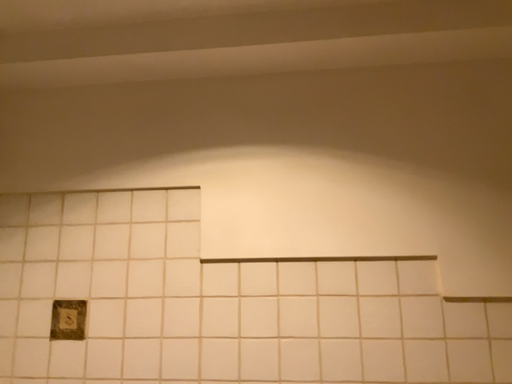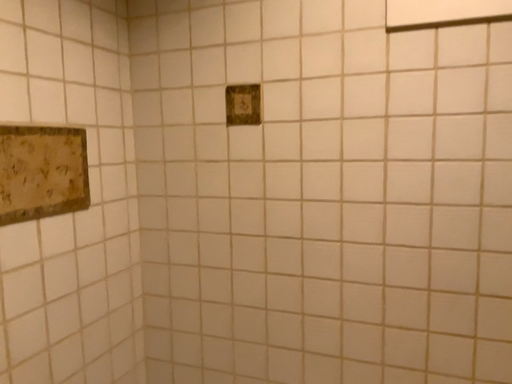
Question: How did the camera likely rotate when shooting the video?

Choices:
 (A) rotated downward
 (B) rotated upward

Answer: (A)